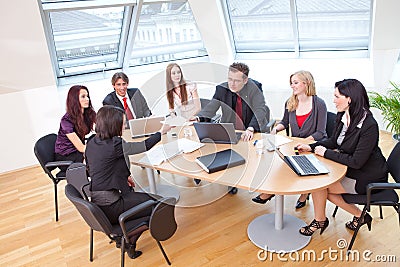
Locate an element on the screen. glass of water is located at coordinates (186, 130).